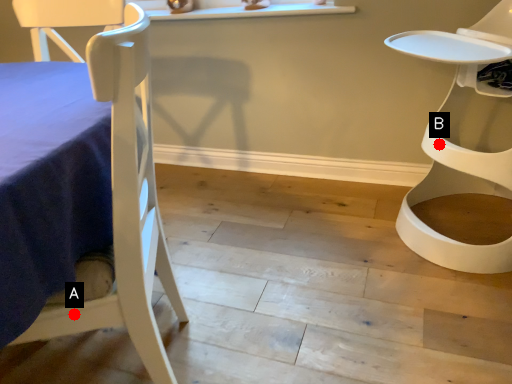
Question: Two points are circled on the image, labeled by A and B beside each circle. Which point appears closest to the camera in this image?

Choices:
 (A) A is closer
 (B) B is closer

Answer: (A)